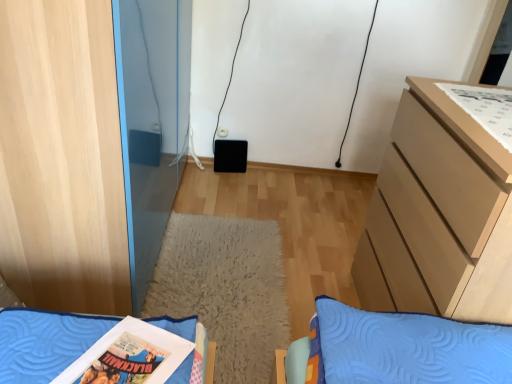
Question: Is the position of light wood cabinet at left less distant than that of light brown wooden chest of drawers at right?

Choices:
 (A) no
 (B) yes

Answer: (A)

Question: From a real-world perspective, does light wood cabinet at left sit lower than light brown wooden chest of drawers at right?

Choices:
 (A) yes
 (B) no

Answer: (B)

Question: Is light wood cabinet at left at the left side of light brown wooden chest of drawers at right?

Choices:
 (A) no
 (B) yes

Answer: (B)

Question: Is light brown wooden chest of drawers at right at the back of light wood cabinet at left?

Choices:
 (A) yes
 (B) no

Answer: (B)

Question: Is light wood cabinet at left further to camera compared to light brown wooden chest of drawers at right?

Choices:
 (A) no
 (B) yes

Answer: (B)

Question: Could you tell me if light wood cabinet at left is turned towards light brown wooden chest of drawers at right?

Choices:
 (A) yes
 (B) no

Answer: (A)

Question: Is light brown wooden chest of drawers at right to the left of light wood cabinet at left from the viewer's perspective?

Choices:
 (A) no
 (B) yes

Answer: (A)

Question: Is light wood cabinet at left a part of light brown wooden chest of drawers at right?

Choices:
 (A) yes
 (B) no

Answer: (B)

Question: Does light brown wooden chest of drawers at right turn towards light wood cabinet at left?

Choices:
 (A) no
 (B) yes

Answer: (B)

Question: Can you confirm if light brown wooden chest of drawers at right is thinner than light wood cabinet at left?

Choices:
 (A) no
 (B) yes

Answer: (B)

Question: Is the depth of light brown wooden chest of drawers at right greater than that of light wood cabinet at left?

Choices:
 (A) yes
 (B) no

Answer: (B)

Question: Does light brown wooden chest of drawers at right have a lesser height compared to light wood cabinet at left?

Choices:
 (A) no
 (B) yes

Answer: (B)

Question: Is the position of light wood cabinet at left more distant than that of white paper comic book at upper right?

Choices:
 (A) no
 (B) yes

Answer: (A)